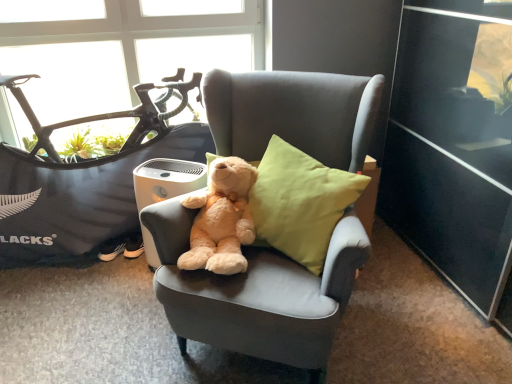
This screenshot has height=384, width=512. Identify the location of spots to the right of soft gray fabric chair at center. (415, 313).